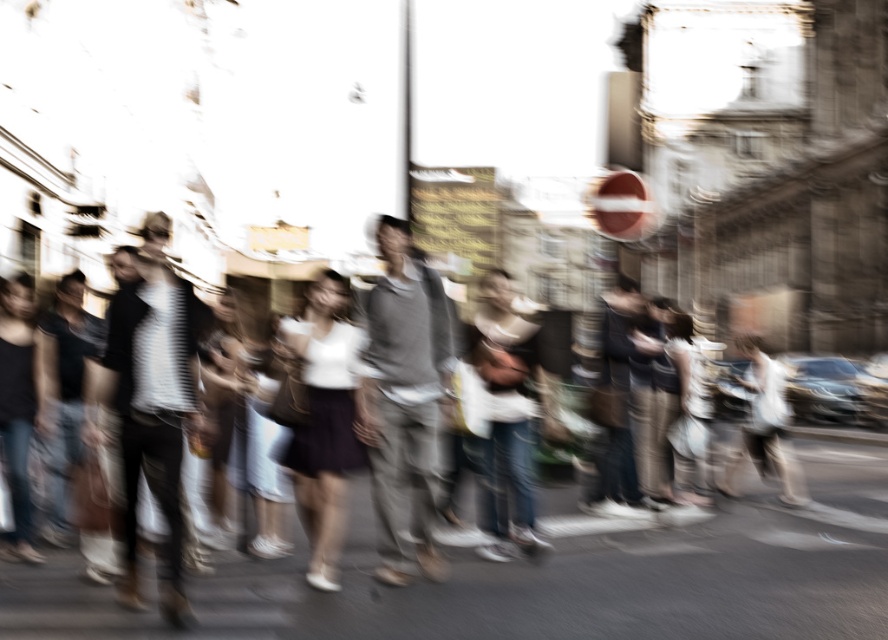
Can you confirm if matte gray pants at center is positioned below gray fabric skateboard at center?

Indeed, matte gray pants at center is positioned under gray fabric skateboard at center.

Is matte gray pants at center smaller than gray fabric skateboard at center?

No, matte gray pants at center is not smaller than gray fabric skateboard at center.

Is point (456, 609) farther from camera compared to point (393, 556)?

No.

At what (x,y) coordinates should I click in order to perform the action: click on matte gray pants at center. Please return your answer as a coordinate pair (x, y). This screenshot has height=640, width=888. Looking at the image, I should click on (536, 582).